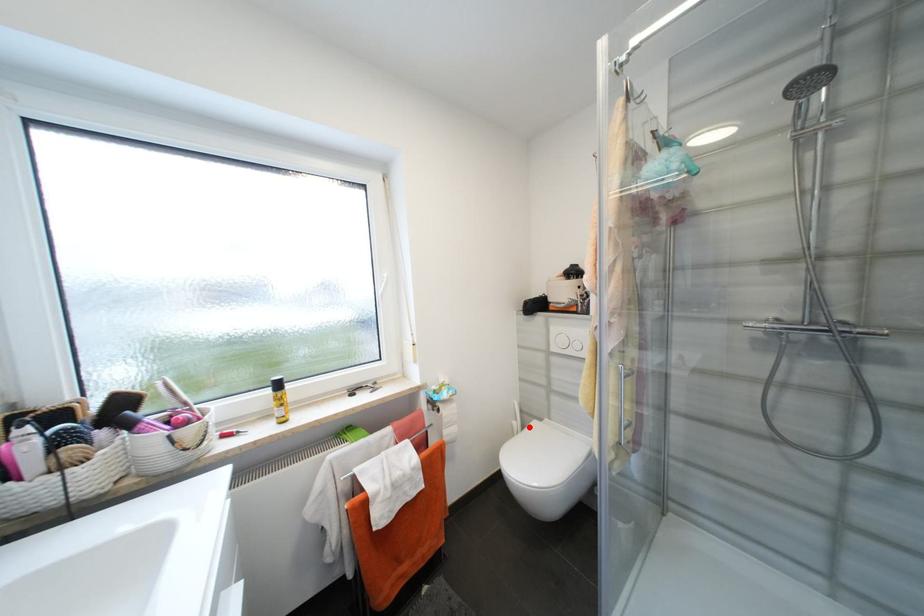
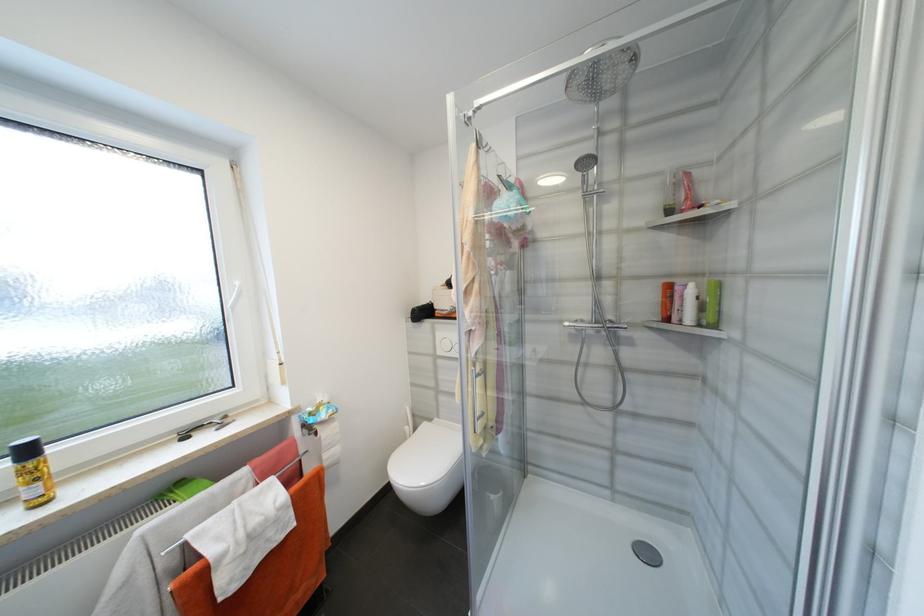
In the second image, find the point that corresponds to the highlighted location in the first image.

(420, 431)